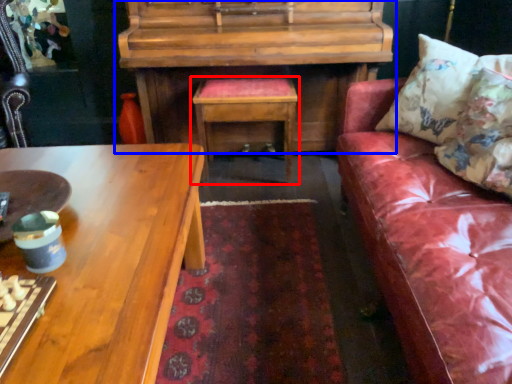
Question: Which of the following is the farthest to the observer, table (highlighted by a red box) or piano (highlighted by a blue box)?

Choices:
 (A) table
 (B) piano

Answer: (A)